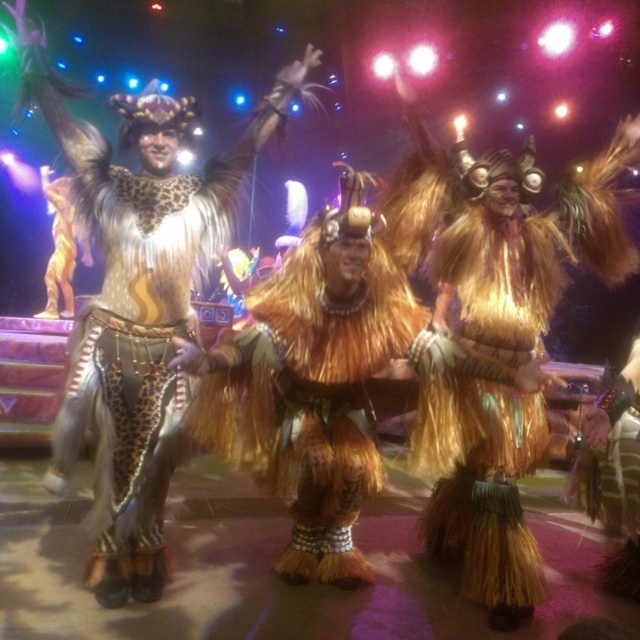
You are an audience member sitting in the front row of the performance. You notice two elements on the central performer. One is the fuzzy brown fur at center and the other is the fuzzy golden skirt at center. Which of these two items is positioned lower on the performer?

The fuzzy brown fur at center is below the fuzzy golden skirt at center, so the fuzzy brown fur at center is positioned lower on the performer.

You are a stagehand who needs to place a 20 inch wide decorative panel between the fuzzy brown fur at center and the fuzzy golden skirt at center. Can the panel fit between them?

→ The fuzzy brown fur at center and fuzzy golden skirt at center are 19.55 inches apart from each other. Since the panel is 20 inches wide, it cannot fit between them as the distance is slightly less than the panel width.

You are a stagehand responsible for ensuring that all costumes fit within the designated performance area. The performance area has a maximum width limit of 1.2 meters. You observe the leather fur coat at center and the fuzzy brown fur at center. Can both costumes fit within the width limit if placed side by side?

The leather fur coat at center is wider than the fuzzy brown fur at center. However, since the exact widths are not provided, it is impossible to determine if their combined width exceeds the 1.2 meter limit. Additional measurements are needed to ensure compliance with the width restriction.